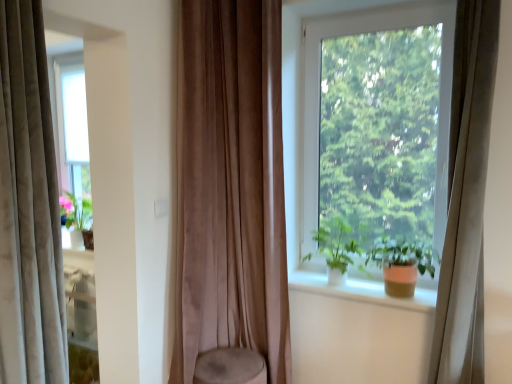
Find the location of a particular element. empty space that is ontop of white smooth window sill at center (from a real-world perspective) is located at coordinates (369, 283).